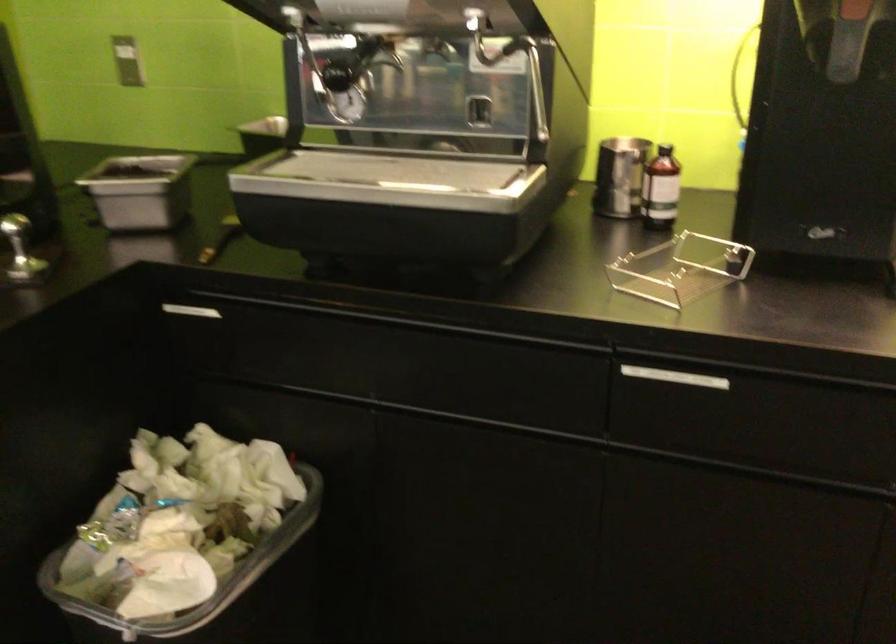
Describe the element at coordinates (192, 310) in the screenshot. I see `the silver drawer handle` at that location.